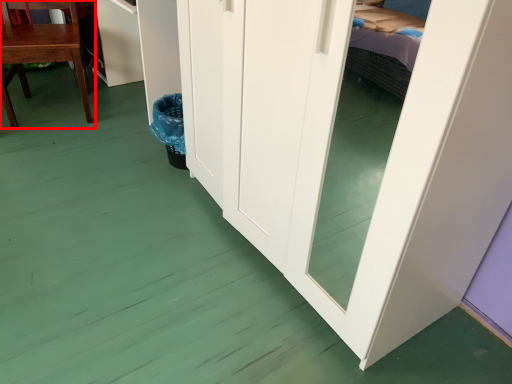
Question: From the image's perspective, what is the correct spatial positioning of chair (annotated by the red box) in reference to cabinetry?

Choices:
 (A) below
 (B) above

Answer: (A)